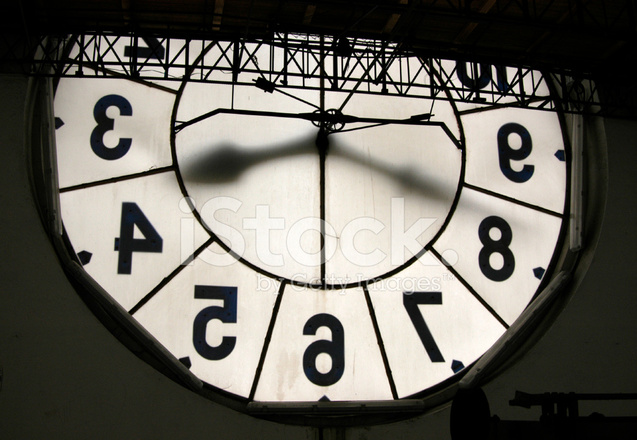
Where is `grey wall`? This screenshot has width=637, height=440. grey wall is located at coordinates (16, 204), (599, 260), (118, 387).